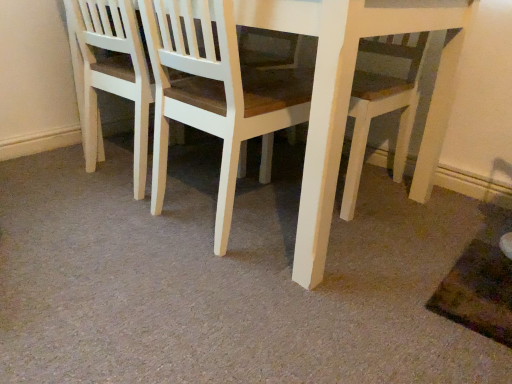
Describe the element at coordinates (215, 94) in the screenshot. This screenshot has width=512, height=384. I see `white wood chair at center, marked as the second chair in a left-to-right arrangement` at that location.

Locate an element on the screen. white wood chair at center, acting as the first chair starting from the right is located at coordinates (215, 94).

The height and width of the screenshot is (384, 512). What do you see at coordinates (110, 74) in the screenshot? I see `white wood chair at center, arranged as the 1th chair when viewed from the left` at bounding box center [110, 74].

Find the location of a particular element. white wood chair at center, the 2th chair in the right-to-left sequence is located at coordinates (110, 74).

The height and width of the screenshot is (384, 512). Find the location of `white wood chair at center, marked as the second chair in a left-to-right arrangement`. white wood chair at center, marked as the second chair in a left-to-right arrangement is located at coordinates tap(215, 94).

Between white wood chair at center, the 2th chair in the right-to-left sequence, and white wood chair at center, marked as the second chair in a left-to-right arrangement, which one appears on the left side from the viewer's perspective?

Positioned to the left is white wood chair at center, the 2th chair in the right-to-left sequence.

Is white wood chair at center, arranged as the 1th chair when viewed from the left, further to the viewer compared to white wood chair at center, acting as the first chair starting from the right?

Yes, white wood chair at center, arranged as the 1th chair when viewed from the left, is further from the viewer.

Does point (110, 46) appear closer or farther from the camera than point (167, 52)?

Point (110, 46).

From the image's perspective, between white wood chair at center, the 2th chair in the right-to-left sequence, and white wood chair at center, acting as the first chair starting from the right, who is located below?

white wood chair at center, acting as the first chair starting from the right, from the image's perspective.

From a real-world perspective, who is located higher, white wood chair at center, the 2th chair in the right-to-left sequence, or white wood chair at center, acting as the first chair starting from the right?

white wood chair at center, acting as the first chair starting from the right, from a real-world perspective.

Is white wood chair at center, arranged as the 1th chair when viewed from the left, thinner than white wood chair at center, acting as the first chair starting from the right?

Yes.

Who is taller, white wood chair at center, the 2th chair in the right-to-left sequence, or white wood chair at center, marked as the second chair in a left-to-right arrangement?

Standing taller between the two is white wood chair at center, marked as the second chair in a left-to-right arrangement.

Is white wood chair at center, the 2th chair in the right-to-left sequence, bigger than white wood chair at center, marked as the second chair in a left-to-right arrangement?

No, white wood chair at center, the 2th chair in the right-to-left sequence, is not bigger than white wood chair at center, marked as the second chair in a left-to-right arrangement.

Is white wood chair at center, acting as the first chair starting from the right, completely or partially inside white wood chair at center, the 2th chair in the right-to-left sequence?

No.

Would you consider white wood chair at center, the 2th chair in the right-to-left sequence, to be distant from white wood chair at center, marked as the second chair in a left-to-right arrangement?

No, there isn't a large distance between white wood chair at center, the 2th chair in the right-to-left sequence, and white wood chair at center, marked as the second chair in a left-to-right arrangement.

Is white wood chair at center, arranged as the 1th chair when viewed from the left, facing towards white wood chair at center, marked as the second chair in a left-to-right arrangement?

No, white wood chair at center, arranged as the 1th chair when viewed from the left, is not aimed at white wood chair at center, marked as the second chair in a left-to-right arrangement.

Identify the location of chair in front of the white wood chair at center, arranged as the 1th chair when viewed from the left. (215, 94).

Considering the relative positions of white wood chair at center, acting as the first chair starting from the right, and white wood chair at center, arranged as the 1th chair when viewed from the left, in the image provided, is white wood chair at center, acting as the first chair starting from the right, to the left or to the right of white wood chair at center, arranged as the 1th chair when viewed from the left,?

Based on their positions, white wood chair at center, acting as the first chair starting from the right, is located to the right of white wood chair at center, arranged as the 1th chair when viewed from the left.

Is white wood chair at center, acting as the first chair starting from the right, in front of white wood chair at center, the 2th chair in the right-to-left sequence?

Yes, white wood chair at center, acting as the first chair starting from the right, is in front of white wood chair at center, the 2th chair in the right-to-left sequence.

Does point (153, 152) come farther from viewer compared to point (84, 4)?

Yes.

In the scene shown: From the image's perspective, is white wood chair at center, marked as the second chair in a left-to-right arrangement, located above or below white wood chair at center, the 2th chair in the right-to-left sequence?

white wood chair at center, marked as the second chair in a left-to-right arrangement, is below white wood chair at center, the 2th chair in the right-to-left sequence.

From a real-world perspective, is white wood chair at center, marked as the second chair in a left-to-right arrangement, positioned under white wood chair at center, arranged as the 1th chair when viewed from the left, based on gravity?

No, from a real-world perspective, white wood chair at center, marked as the second chair in a left-to-right arrangement, is not under white wood chair at center, arranged as the 1th chair when viewed from the left.

Does white wood chair at center, acting as the first chair starting from the right, have a greater width compared to white wood chair at center, the 2th chair in the right-to-left sequence?

Yes.

In terms of height, does white wood chair at center, acting as the first chair starting from the right, look taller or shorter compared to white wood chair at center, the 2th chair in the right-to-left sequence?

Clearly, white wood chair at center, acting as the first chair starting from the right, is taller compared to white wood chair at center, the 2th chair in the right-to-left sequence.

Is white wood chair at center, marked as the second chair in a left-to-right arrangement, bigger than white wood chair at center, the 2th chair in the right-to-left sequence?

Indeed, white wood chair at center, marked as the second chair in a left-to-right arrangement, has a larger size compared to white wood chair at center, the 2th chair in the right-to-left sequence.

Is white wood chair at center, acting as the first chair starting from the right, completely or partially outside of white wood chair at center, arranged as the 1th chair when viewed from the left?

white wood chair at center, acting as the first chair starting from the right, lies outside white wood chair at center, arranged as the 1th chair when viewed from the left,'s area.

Does white wood chair at center, acting as the first chair starting from the right, touch white wood chair at center, arranged as the 1th chair when viewed from the left?

white wood chair at center, acting as the first chair starting from the right, is not next to white wood chair at center, arranged as the 1th chair when viewed from the left, and they're not touching.

Is white wood chair at center, arranged as the 1th chair when viewed from the left, at the back of white wood chair at center, acting as the first chair starting from the right?

white wood chair at center, acting as the first chair starting from the right, does not have its back to white wood chair at center, arranged as the 1th chair when viewed from the left.

What's the angular difference between white wood chair at center, marked as the second chair in a left-to-right arrangement, and white wood chair at center, the 2th chair in the right-to-left sequence,'s facing directions?

The angle between the facing direction of white wood chair at center, marked as the second chair in a left-to-right arrangement, and the facing direction of white wood chair at center, the 2th chair in the right-to-left sequence, is 3.45 degrees.

The height and width of the screenshot is (384, 512). I want to click on chair below the white wood chair at center, arranged as the 1th chair when viewed from the left (from the image's perspective), so click(215, 94).

At what (x,y) coordinates should I click in order to perform the action: click on chair on the right of white wood chair at center, the 2th chair in the right-to-left sequence. Please return your answer as a coordinate pair (x, y). This screenshot has height=384, width=512. Looking at the image, I should click on (215, 94).

Where is `chair in front of the white wood chair at center, arranged as the 1th chair when viewed from the left`? The width and height of the screenshot is (512, 384). chair in front of the white wood chair at center, arranged as the 1th chair when viewed from the left is located at coordinates (215, 94).